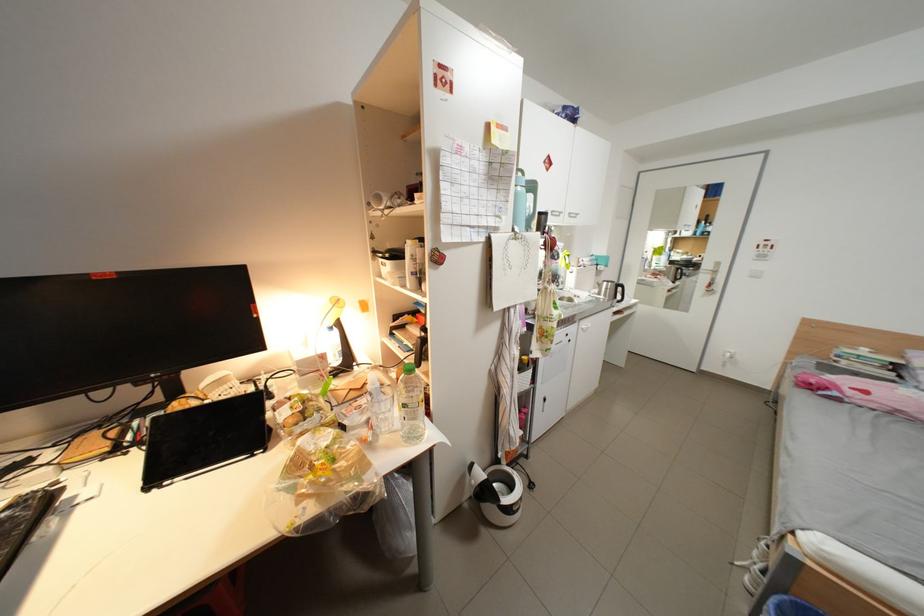
Identify the location of book on bed. This screenshot has width=924, height=616. (878, 367).